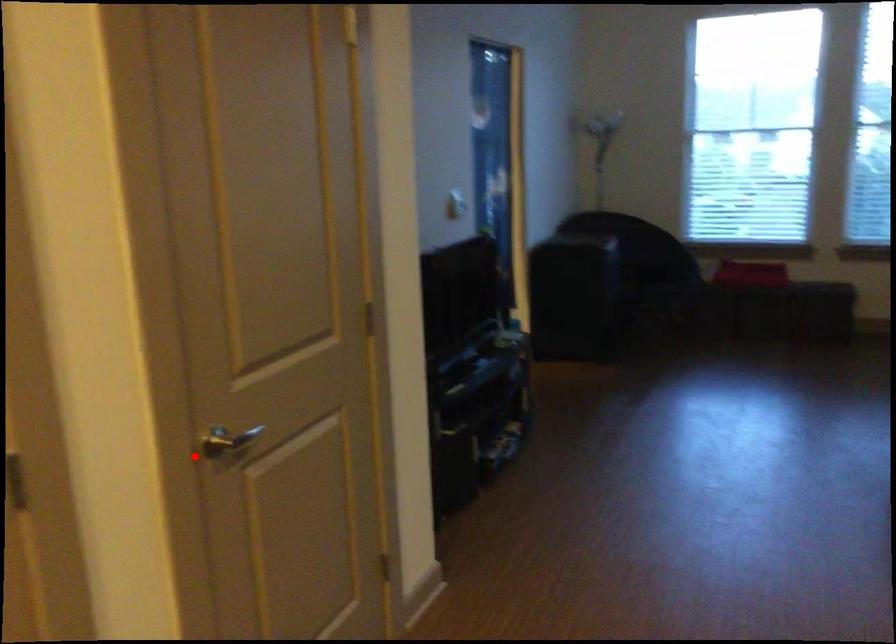
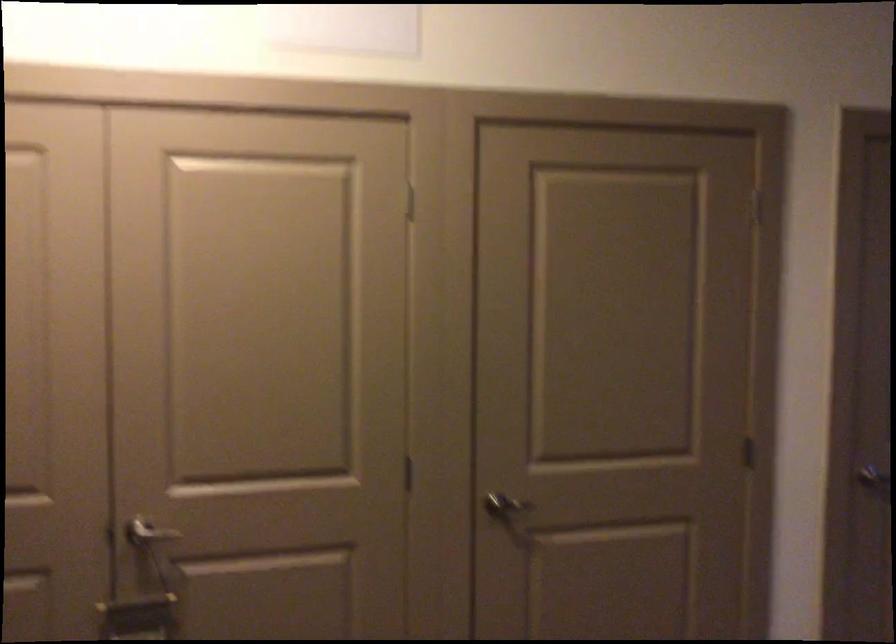
The point at the highlighted location is marked in the first image. Where is the corresponding point in the second image?

(853, 476)